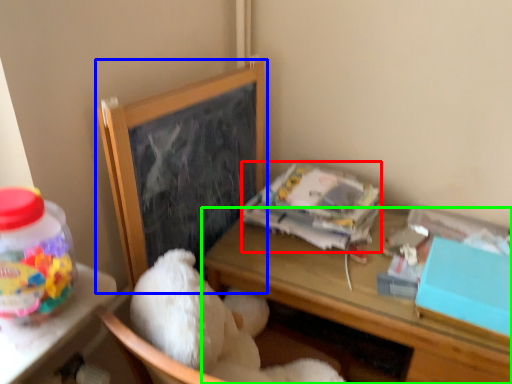
Question: Considering the real-world distances, which object is closest to paperback book (highlighted by a red box)? bulletin board (highlighted by a blue box) or desk (highlighted by a green box).

Choices:
 (A) bulletin board
 (B) desk

Answer: (B)